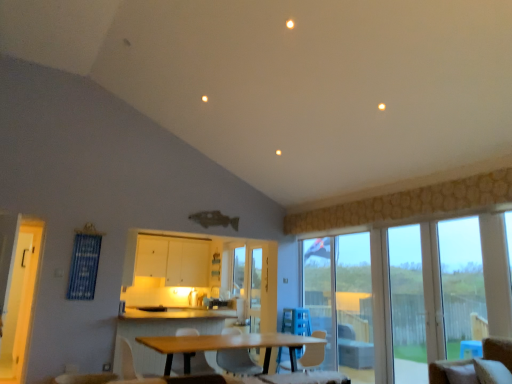
Describe the element at coordinates (133, 368) in the screenshot. I see `white plastic armchair at lower center, positioned as the second armchair in back-to-front order` at that location.

In the scene shown: What is the approximate height of white matte cabinet at center?

white matte cabinet at center is 3.31 feet tall.

This screenshot has height=384, width=512. What do you see at coordinates (173, 260) in the screenshot? I see `white matte cabinet at center` at bounding box center [173, 260].

From the picture: What is the approximate height of transparent glass door at right?

It is 6.95 feet.

Find the location of a particular element. This screenshot has width=512, height=384. transparent glass door at right is located at coordinates (341, 301).

Where is `clear glass door at right, which appears as the 2th window when viewed from the right`? The height and width of the screenshot is (384, 512). clear glass door at right, which appears as the 2th window when viewed from the right is located at coordinates (407, 305).

Is wooden table at center thinner than white plastic chair at center, which is the third chair in front-to-back order?

No.

Considering the relative positions of wooden table at center and white plastic chair at center, which appears as the 2th chair when viewed from the left, in the image provided, is wooden table at center to the right of white plastic chair at center, which appears as the 2th chair when viewed from the left, from the viewer's perspective?

Incorrect, wooden table at center is not on the right side of white plastic chair at center, which appears as the 2th chair when viewed from the left.

Considering the relative sizes of wooden table at center and white plastic chair at center, which is the third chair in front-to-back order, in the image provided, is wooden table at center bigger than white plastic chair at center, which is the third chair in front-to-back order,?

Indeed, wooden table at center has a larger size compared to white plastic chair at center, which is the third chair in front-to-back order.

Is white plastic chair at center, arranged as the 2th chair when viewed from the right, inside wooden table at center?

Absolutely, white plastic chair at center, arranged as the 2th chair when viewed from the right, is inside wooden table at center.

In the scene shown: From a real-world perspective, which object rests below the other?

white plastic chair at center, which is the 1th chair in back-to-front order.

Is white matte cabinet at center facing towards white plastic chair at center, which is the third chair in front-to-back order?

Yes, white matte cabinet at center is aimed at white plastic chair at center, which is the third chair in front-to-back order.

Does white matte cabinet at center appear on the left side of white plastic chair at center, which appears as the 2th chair when viewed from the left?

Yes.

Considering the sizes of objects white matte cabinet at center and white plastic chair at center, which appears as the 2th chair when viewed from the left, in the image provided, who is taller, white matte cabinet at center or white plastic chair at center, which appears as the 2th chair when viewed from the left,?

Standing taller between the two is white matte cabinet at center.

From the image's perspective, which one is positioned higher, transparent glass door at right, the 1th window in the right-to-left sequence, or beige fabric chair at lower right, the 3th chair when ordered from back to front?

transparent glass door at right, the 1th window in the right-to-left sequence.

Can beige fabric chair at lower right, the third chair in the left-to-right sequence, be found inside transparent glass door at right, the 1th window in the right-to-left sequence?

No, beige fabric chair at lower right, the third chair in the left-to-right sequence, is not surrounded by transparent glass door at right, the 1th window in the right-to-left sequence.

Who is bigger, transparent glass door at right, the 2th window viewed from the left, or beige fabric chair at lower right, acting as the first chair starting from the front?

With larger size is transparent glass door at right, the 2th window viewed from the left.

Which object is thinner, transparent glass door at right, the 1th window in the right-to-left sequence, or beige fabric chair at lower right, the third chair in the left-to-right sequence?

Thinner between the two is transparent glass door at right, the 1th window in the right-to-left sequence.

Looking at this image, from the image's perspective, relative to wooden table at center, is white plastic armchair at center, the 2th armchair positioned from the front, above or below?

Based on their image positions, white plastic armchair at center, the 2th armchair positioned from the front, is located above wooden table at center.

From a real-world perspective, who is located lower, white plastic armchair at center, the 2th armchair positioned from the front, or wooden table at center?

wooden table at center, from a real-world perspective.

Is white plastic armchair at center, the 2th armchair positioned from the front, far from wooden table at center?

Yes.

Is white plastic armchair at center, the 2th armchair positioned from the front, wider or thinner than wooden table at center?

white plastic armchair at center, the 2th armchair positioned from the front, is thinner than wooden table at center.

From a real-world perspective, is white matte cabinet at center positioned under white plastic swivel chair at center based on gravity?

No, from a real-world perspective, white matte cabinet at center is not below white plastic swivel chair at center.

Is point (147, 242) closer or farther from the camera than point (285, 311)?

Point (147, 242) is farther from the camera than point (285, 311).

Is white matte cabinet at center aimed at white plastic swivel chair at center?

Yes, white matte cabinet at center is turned towards white plastic swivel chair at center.

Does white matte cabinet at center have a smaller size compared to white plastic swivel chair at center?

Actually, white matte cabinet at center might be larger than white plastic swivel chair at center.

Which of these two, white plastic armchair at center, which is counted as the 1th armchair, starting from the back, or transparent glass door at right, the 2th window viewed from the left, is thinner?

transparent glass door at right, the 2th window viewed from the left, is thinner.

Which is behind, white plastic armchair at center, which is counted as the 1th armchair, starting from the back, or transparent glass door at right, the 2th window viewed from the left?

white plastic armchair at center, which is counted as the 1th armchair, starting from the back, is behind.

Is white plastic armchair at center, the 2th armchair positioned from the front, shorter than transparent glass door at right, the 1th window in the right-to-left sequence?

Indeed, white plastic armchair at center, the 2th armchair positioned from the front, has a lesser height compared to transparent glass door at right, the 1th window in the right-to-left sequence.

Identify the location of the 2nd window counting from the right side of the white plastic armchair at center, the 2th armchair positioned from the front. (462, 284).

Is point (141, 382) more distant than point (200, 353)?

That is False.

Is white plastic armchair at lower center, acting as the first armchair starting from the front, taller than white plastic armchair at center, the 2th armchair positioned from the front?

Incorrect, the height of white plastic armchair at lower center, acting as the first armchair starting from the front, is not larger of that of white plastic armchair at center, the 2th armchair positioned from the front.

Does white plastic armchair at lower center, positioned as the second armchair in back-to-front order, touch white plastic armchair at center, which is counted as the 1th armchair, starting from the back?

No, white plastic armchair at lower center, positioned as the second armchair in back-to-front order, is not next to white plastic armchair at center, which is counted as the 1th armchair, starting from the back.

Starting from the wooden table at center, which chair is the 2nd one behind? Please provide its 2D coordinates.

[(312, 356)]

From the image's perspective, which chair is the 2nd one below the white matte cabinet at center? Please provide its 2D coordinates.

[(312, 356)]

Estimate the real-world distances between objects in this image. Which object is further from yellow wood screen door at left, the second screen door from the right, wooden table at center or blue fabric curtain at left?

The object further to yellow wood screen door at left, the second screen door from the right, is wooden table at center.

Estimate the real-world distances between objects in this image. Which object is further from blue fabric curtain at left, yellow wood screen door at left, placed as the 2th screen door when sorted from back to front, or white plastic armchair at center, the 2th armchair positioned from the front?

white plastic armchair at center, the 2th armchair positioned from the front, lies further to blue fabric curtain at left than the other object.

From the image, which object appears to be farther from yellow wood screen door at left, placed as the 2th screen door when sorted from back to front, transparent glass screen door at center, the 1th screen door from the back, or white plastic armchair at center, the 2th armchair positioned from the front?

transparent glass screen door at center, the 1th screen door from the back, lies further to yellow wood screen door at left, placed as the 2th screen door when sorted from back to front, than the other object.

Estimate the real-world distances between objects in this image. Which object is closer to blue fabric curtain at left, white plastic chair at center, which appears as the 2th chair when viewed from the left, or beige fabric chair at lower right, acting as the 1th chair starting from the right?

white plastic chair at center, which appears as the 2th chair when viewed from the left, lies closer to blue fabric curtain at left than the other object.

Estimate the real-world distances between objects in this image. Which object is further from transparent glass door at right, the 1th window in the right-to-left sequence, white plastic armchair at lower center, acting as the first armchair starting from the front, or white plastic armchair at center, which is counted as the 1th armchair, starting from the back?

white plastic armchair at lower center, acting as the first armchair starting from the front, is further to transparent glass door at right, the 1th window in the right-to-left sequence.

Considering their positions, is white plastic armchair at lower center, acting as the first armchair starting from the front, positioned further to white matte cabinet at center than wooden table at center?

Among the two, wooden table at center is located further to white matte cabinet at center.

From the picture: When comparing their distances from transparent glass door at right, the 1th window in the right-to-left sequence, does beige fabric chair at lower right, the third chair in the left-to-right sequence, or matte gray chair at center, which is the first chair from left to right, seem further?

matte gray chair at center, which is the first chair from left to right, is positioned further to the anchor transparent glass door at right, the 1th window in the right-to-left sequence.

From the image, which object appears to be nearer to white matte cabinet at center, white plastic chair at center, which is the third chair in front-to-back order, or white plastic swivel chair at center?

white plastic swivel chair at center.

This screenshot has height=384, width=512. I want to click on window between white plastic armchair at lower center, acting as the first armchair starting from the front, and beige fabric chair at lower right, the third chair in the left-to-right sequence, from left to right, so click(407, 305).

At what (x,y) coordinates should I click in order to perform the action: click on curtain located between white plastic armchair at lower center, positioned as the second armchair in back-to-front order, and transparent glass screen door at center, the first screen door when ordered from right to left, in the depth direction. Please return your answer as a coordinate pair (x, y). Looking at the image, I should click on (84, 266).

What are the coordinates of `chair located between matte gray chair at center, marked as the 2th chair in a back-to-front arrangement, and white matte cabinet at center in the depth direction` in the screenshot? It's located at (312, 356).

Where is `glass door located between white plastic armchair at center, which is counted as the 1th armchair, starting from the back, and beige fabric chair at lower right, acting as the 1th chair starting from the right, in the left-right direction`? glass door located between white plastic armchair at center, which is counted as the 1th armchair, starting from the back, and beige fabric chair at lower right, acting as the 1th chair starting from the right, in the left-right direction is located at coordinates (341, 301).